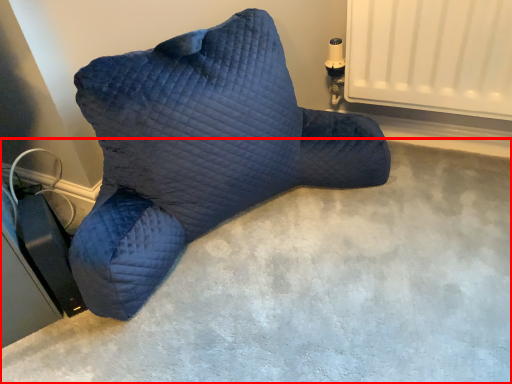
Question: From the image's perspective, considering the relative positions of concrete (annotated by the red box) and furniture in the image provided, where is concrete (annotated by the red box) located with respect to the staircase?

Choices:
 (A) above
 (B) below

Answer: (B)